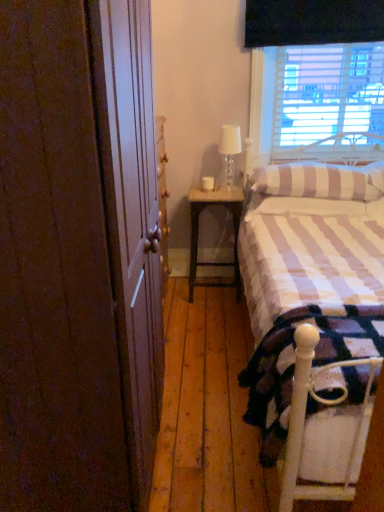
I want to click on vacant space underneath wooden nightstand at center (from a real-world perspective), so click(221, 290).